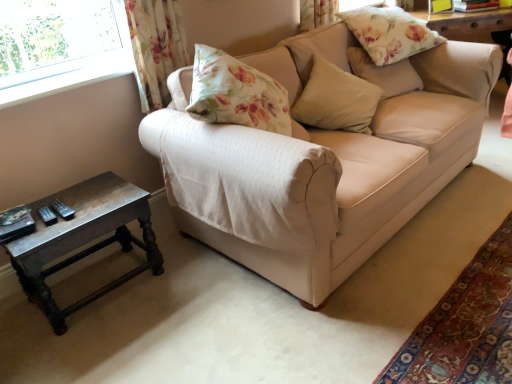
Find the location of `free spot above dark brown wooden table at lower left (from a real-world perspective)`. free spot above dark brown wooden table at lower left (from a real-world perspective) is located at coordinates (78, 203).